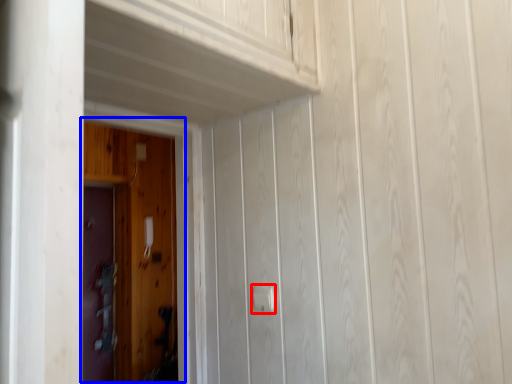
Question: Among these objects, which one is nearest to the camera, door handle (highlighted by a red box) or door (highlighted by a blue box)?

Choices:
 (A) door handle
 (B) door

Answer: (B)